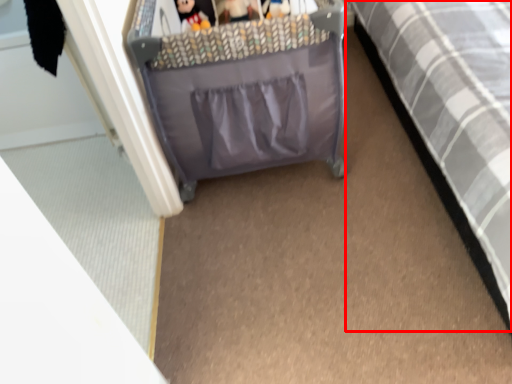
Question: From the image's perspective, where is furniture (annotated by the red box) located in relation to toy in the image?

Choices:
 (A) below
 (B) above

Answer: (A)